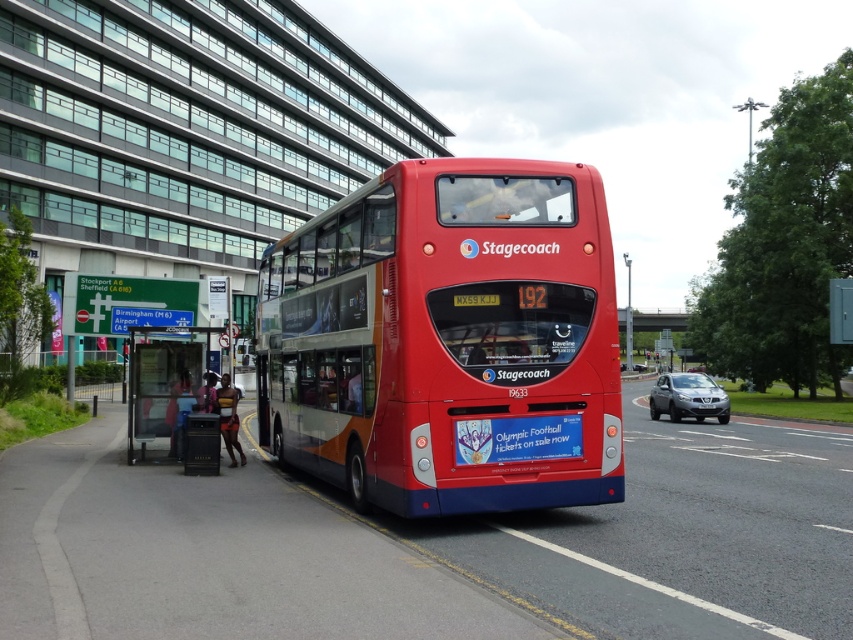
Question: Can you confirm if transparent glass bus stop at center is positioned to the left of white plastic license plate at center?

Choices:
 (A) no
 (B) yes

Answer: (B)

Question: Which of the following is the closest to the observer?

Choices:
 (A) satin silver car at center
 (B) transparent glass bus stop at center
 (C) shiny red bus at center

Answer: (C)

Question: Does transparent glass bus stop at center appear on the right side of white plastic license plate at center?

Choices:
 (A) no
 (B) yes

Answer: (A)

Question: Is shiny red bus at center thinner than white plastic license plate at center?

Choices:
 (A) yes
 (B) no

Answer: (A)

Question: Which point appears farthest from the camera in this image?

Choices:
 (A) (148, 365)
 (B) (599, 388)
 (C) (708, 397)
 (D) (653, 388)

Answer: (D)

Question: Which object appears farthest from the camera in this image?

Choices:
 (A) transparent glass bus stop at center
 (B) white plastic license plate at center
 (C) shiny red bus at center

Answer: (B)